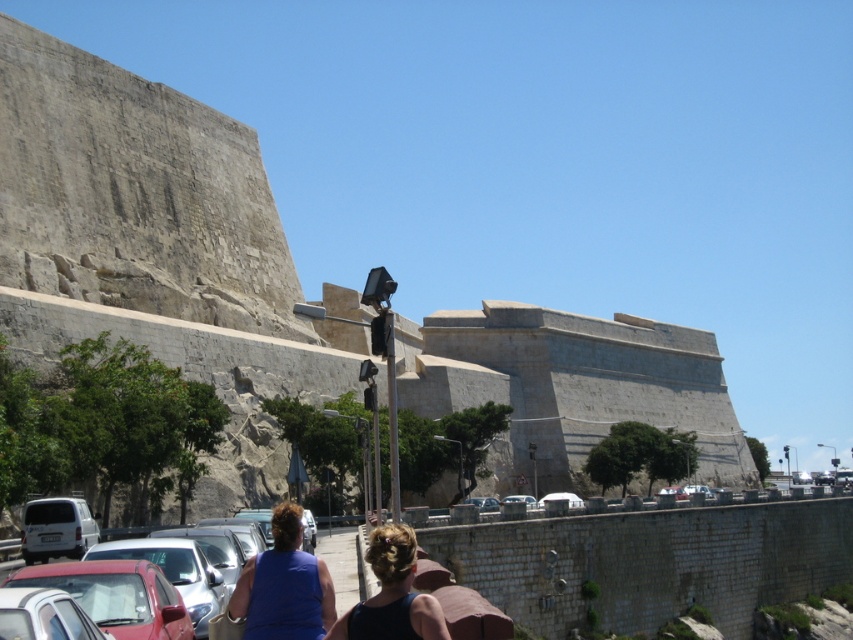
Between point (83, 67) and point (395, 630), which one is positioned in front?

Point (395, 630) is more forward.

Which is more to the right, gray stone wall at center or dark blue fabric at center?

gray stone wall at center is more to the right.

Who is more forward, [90,224] or [338,636]?

Point [338,636] is more forward.

Image resolution: width=853 pixels, height=640 pixels. I want to click on gray stone wall at center, so click(x=154, y=244).

Can you confirm if dark blue fabric at center is positioned to the left of white matte car at center?

Yes, dark blue fabric at center is to the left of white matte car at center.

Can you confirm if dark blue fabric at center is bigger than white matte car at center?

Indeed, dark blue fabric at center has a larger size compared to white matte car at center.

Who is more forward, (x=347, y=611) or (x=537, y=502)?

Point (x=347, y=611) is more forward.

Identify the location of dark blue fabric at center. (399, 588).

Between gray stone wall at center and white matte car at center, which one has less height?

white matte car at center is shorter.

Can you confirm if gray stone wall at center is positioned below white matte car at center?

No.

Where is `gray stone wall at center`? This screenshot has height=640, width=853. gray stone wall at center is located at coordinates (154, 244).